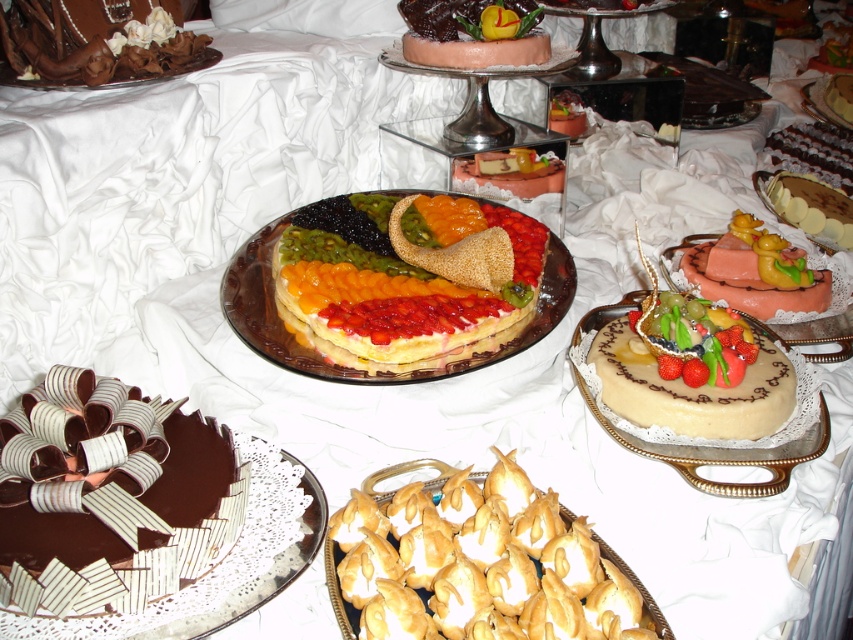
Question: Is golden meringue kisses at center bigger than multicolored fruit tart at center?

Choices:
 (A) no
 (B) yes

Answer: (A)

Question: Does multicolored fruit tart at center appear over smooth cream cake with fruit at center?

Choices:
 (A) no
 (B) yes

Answer: (B)

Question: Observing the image, what is the correct spatial positioning of smooth cream cake with fruit at center in reference to smooth pink cake with fruit at center?

Choices:
 (A) right
 (B) left

Answer: (B)

Question: Which of the following is the closest to the observer?

Choices:
 (A) smooth chocolate cake at center
 (B) chocolate matte cake at lower left

Answer: (B)

Question: Which point is closer to the camera?

Choices:
 (A) (838, 80)
 (B) (177, 570)
 (C) (553, 246)
 (D) (416, 13)

Answer: (B)

Question: Which object is closer to the camera taking this photo?

Choices:
 (A) chocolate matte cake at lower left
 (B) pink frosted cake at center

Answer: (A)